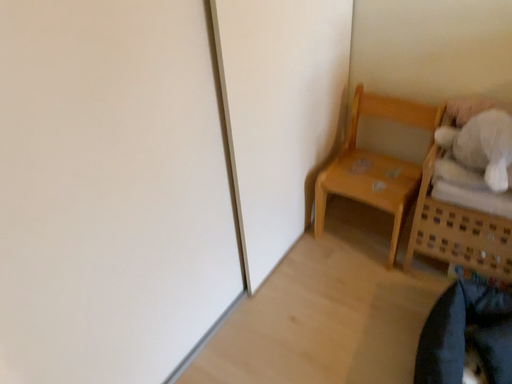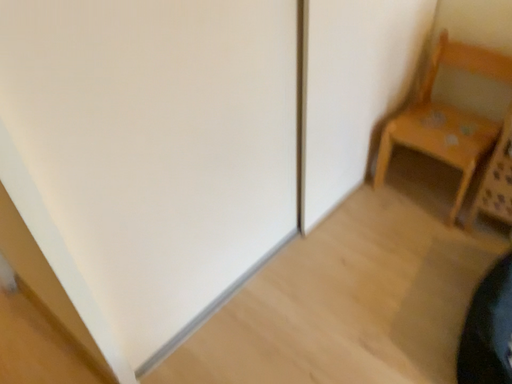
Question: Which way did the camera rotate in the video?

Choices:
 (A) rotated right
 (B) rotated left

Answer: (B)